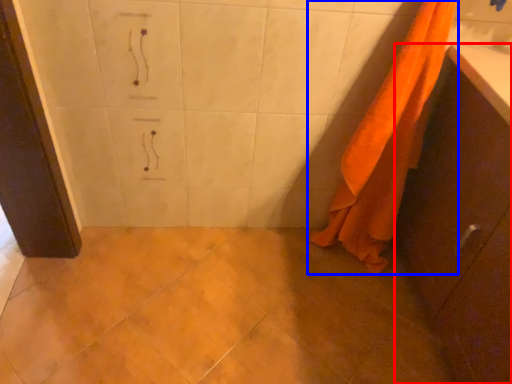
Question: Which point is closer to the camera, bathroom cabinet (highlighted by a red box) or towel (highlighted by a blue box)?

Choices:
 (A) bathroom cabinet
 (B) towel

Answer: (A)